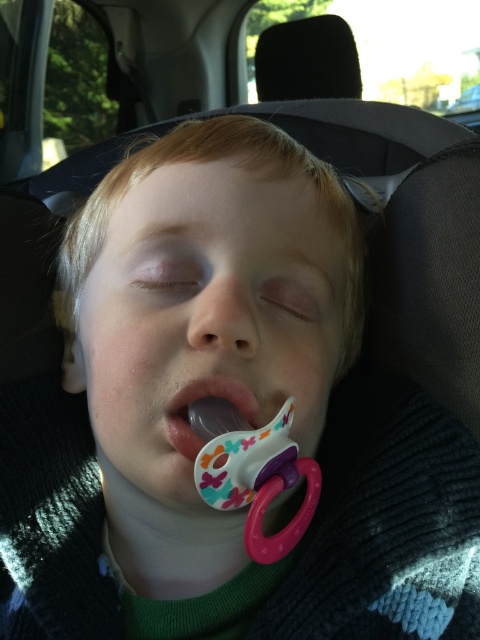
Question: Estimate the real-world distances between objects in this image. Which object is farther from the matte plastic pacifier at center?

Choices:
 (A) white plastic pacifier at center
 (B) black plastic car seat at upper center

Answer: (B)

Question: Estimate the real-world distances between objects in this image. Which object is farther from the matte plastic pacifier at center?

Choices:
 (A) black plastic car seat at upper center
 (B) white plastic pacifier at center

Answer: (A)

Question: Which point is closer to the camera?

Choices:
 (A) matte plastic pacifier at center
 (B) black plastic car seat at upper center
 (C) white plastic pacifier at center

Answer: (A)

Question: Can you confirm if matte plastic pacifier at center is smaller than white plastic pacifier at center?

Choices:
 (A) no
 (B) yes

Answer: (A)

Question: Is white plastic pacifier at center behind black plastic car seat at upper center?

Choices:
 (A) no
 (B) yes

Answer: (A)

Question: Can you confirm if matte plastic pacifier at center is positioned below white plastic pacifier at center?

Choices:
 (A) yes
 (B) no

Answer: (A)